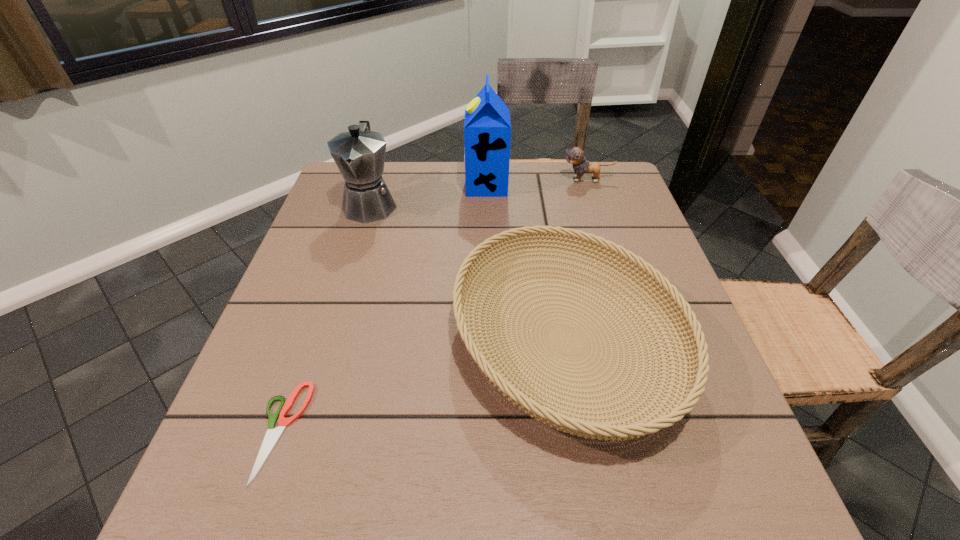
Locate which object is the third closest to the coffeepot. Please provide its 2D coordinates. Your answer should be formatted as a tuple, i.e. [(x, y)], where the tuple contains the x and y coordinates of a point satisfying the conditions above.

[(272, 435)]

Find the location of a particular element. vacant region that satisfies the following two spatial constraints: 1. with the cap open on the basket; 2. on the left side of the carton is located at coordinates (490, 341).

Identify the location of free location that satisfies the following two spatial constraints: 1. with the cap open on the carton; 2. on the right side of the basket. (490, 341).

I want to click on free space that satisfies the following two spatial constraints: 1. with the cap open on the carton; 2. at the spout of the fourth shortest object, so tap(487, 205).

Where is `free space that satisfies the following two spatial constraints: 1. with the cap open on the tallest object; 2. at the spout of the fourth shortest object`? The height and width of the screenshot is (540, 960). free space that satisfies the following two spatial constraints: 1. with the cap open on the tallest object; 2. at the spout of the fourth shortest object is located at coordinates (487, 205).

Locate an element on the screen. free point that satisfies the following two spatial constraints: 1. with the cap open on the tallest object; 2. on the left side of the basket is located at coordinates (490, 341).